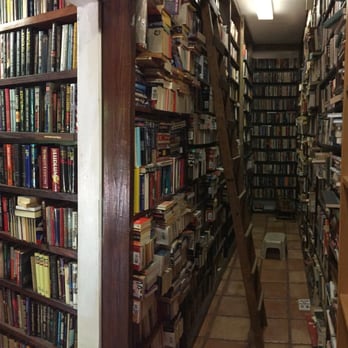
I want to click on book case, so click(x=116, y=115).